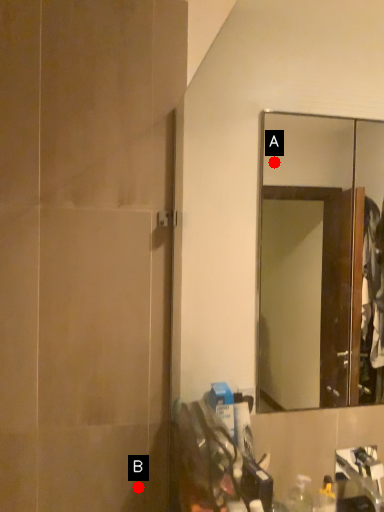
Question: Two points are circled on the image, labeled by A and B beside each circle. Which of the following is the closest to the observer?

Choices:
 (A) A is closer
 (B) B is closer

Answer: (B)